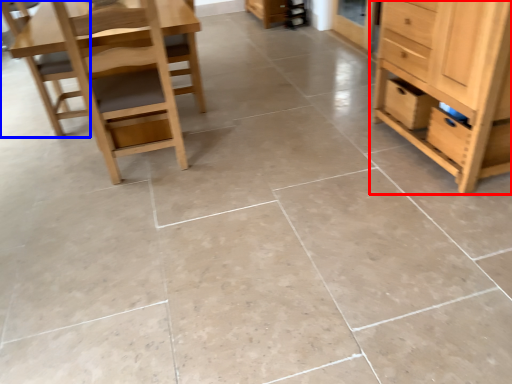
Question: Which point is further to the camera, chest of drawers (highlighted by a red box) or chair (highlighted by a blue box)?

Choices:
 (A) chest of drawers
 (B) chair

Answer: (B)